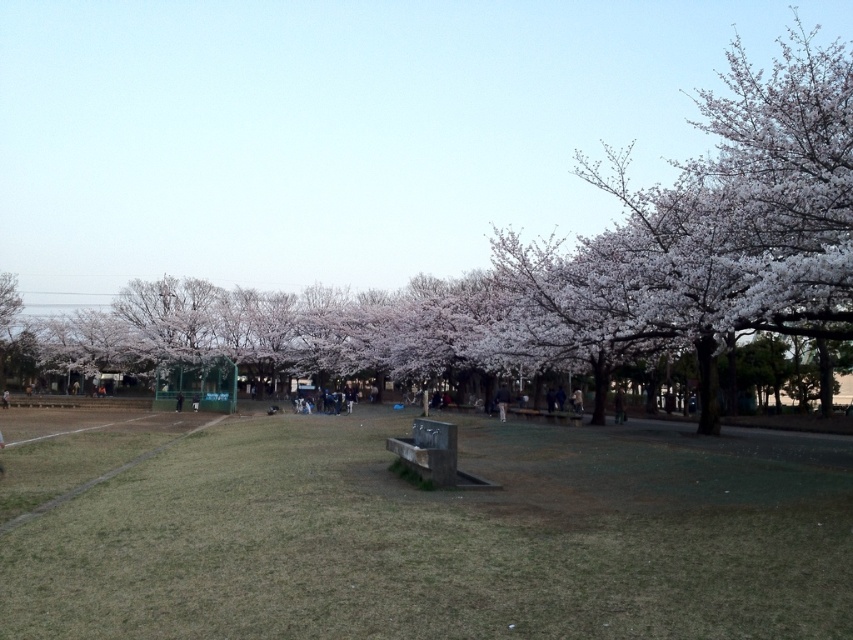
Question: Does white blossoms at center have a lesser width compared to dark blue jeans at center?

Choices:
 (A) no
 (B) yes

Answer: (A)

Question: Is green grass at center wider than dark blue jeans at center?

Choices:
 (A) yes
 (B) no

Answer: (A)

Question: Which point is closer to the camera taking this photo?

Choices:
 (A) (448, 604)
 (B) (498, 419)

Answer: (A)

Question: Which point is closer to the camera taking this photo?

Choices:
 (A) (26, 74)
 (B) (500, 412)

Answer: (B)

Question: Among these objects, which one is farthest from the camera?

Choices:
 (A) dark blue jeans at center
 (B) white blossoms at center

Answer: (B)

Question: Can you confirm if white blossoms at center is bigger than green grass at center?

Choices:
 (A) no
 (B) yes

Answer: (B)